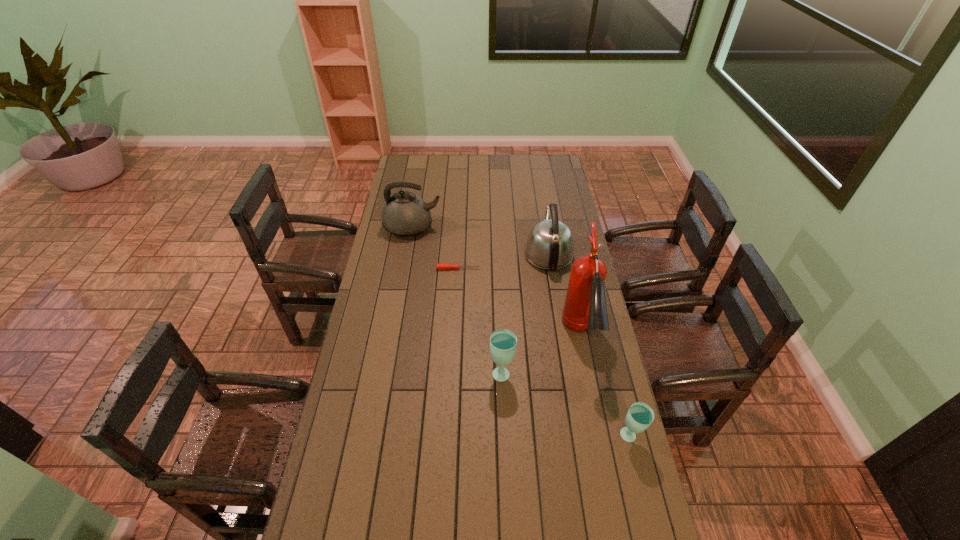
Identify the location of free space at the left edge of the desktop. (328, 457).

The image size is (960, 540). In order to click on vacant area at the right edge of the desktop in this screenshot , I will do `click(556, 204)`.

The height and width of the screenshot is (540, 960). In order to click on free space at the far right corner of the desktop in this screenshot , I will do `click(546, 161)`.

The width and height of the screenshot is (960, 540). Find the location of `free space that is in between the nearest object and the fire extinguisher`. free space that is in between the nearest object and the fire extinguisher is located at coordinates (605, 387).

This screenshot has height=540, width=960. Identify the location of free area in between the shortest object and the left kettle. (436, 248).

At what (x,y) coordinates should I click in order to perform the action: click on free spot between the shortest object and the left kettle. Please return your answer as a coordinate pair (x, y). Image resolution: width=960 pixels, height=540 pixels. Looking at the image, I should click on pyautogui.click(x=436, y=248).

Locate an element on the screen. This screenshot has width=960, height=540. free spot between the third shortest object and the right kettle is located at coordinates (525, 313).

Image resolution: width=960 pixels, height=540 pixels. I want to click on free spot between the taller glass and the left kettle, so click(x=457, y=300).

Identify the location of free space between the left glass and the left kettle. The width and height of the screenshot is (960, 540). (457, 300).

Locate an element on the screen. This screenshot has height=540, width=960. free spot between the right kettle and the left kettle is located at coordinates (481, 240).